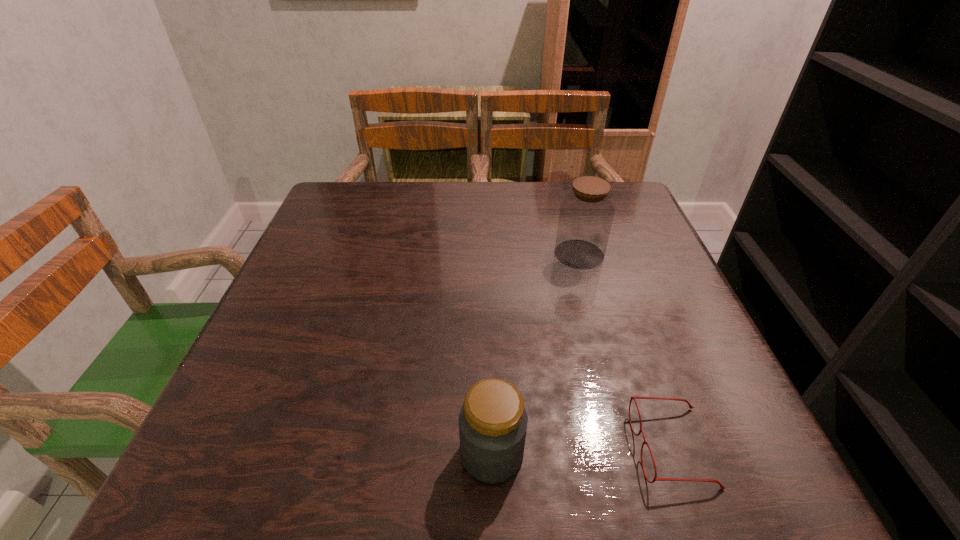
The image size is (960, 540). What are the coordinates of `unoccupied position between the shorter jar and the right jar` in the screenshot? It's located at (536, 354).

Where is `free spot between the spectacles and the tallest object`? This screenshot has width=960, height=540. free spot between the spectacles and the tallest object is located at coordinates (626, 350).

At what (x,y) coordinates should I click in order to perform the action: click on vacant space that is in between the taller jar and the left jar. Please return your answer as a coordinate pair (x, y). Looking at the image, I should click on (536, 354).

You are a GUI agent. You are given a task and a screenshot of the screen. Output one action in this format:
    pyautogui.click(x=<x>, y=<y>)
    Task: Click on the free space between the spectacles and the nearer jar
    
    Given the screenshot: What is the action you would take?
    (582, 450)

The width and height of the screenshot is (960, 540). I want to click on object that is the closest to the farther jar, so tap(632, 397).

You are a GUI agent. You are given a task and a screenshot of the screen. Output one action in this format:
    pyautogui.click(x=<x>, y=<y>)
    Task: Click on the closest object relative to the spectacles
    The width and height of the screenshot is (960, 540).
    Given the screenshot: What is the action you would take?
    click(493, 421)

The height and width of the screenshot is (540, 960). What are the coordinates of `vacant area that satisfies the following two spatial constraints: 1. on the front side of the taller jar; 2. on the surface of the leftmost object near the warning symbol` in the screenshot? It's located at (634, 454).